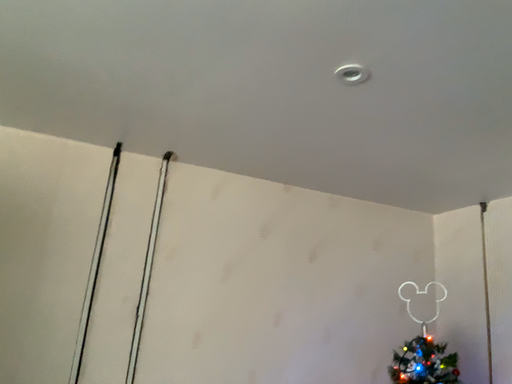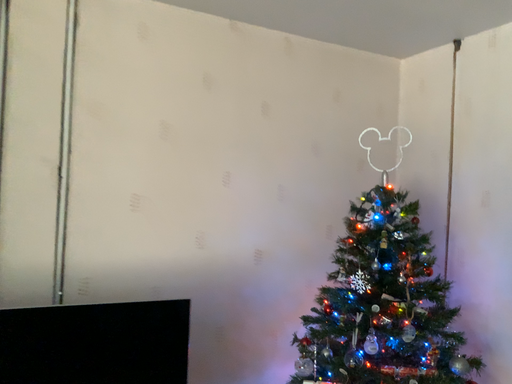
Question: Which way did the camera rotate in the video?

Choices:
 (A) rotated upward
 (B) rotated downward

Answer: (B)